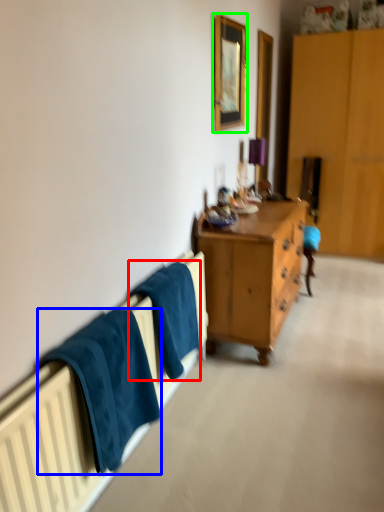
Question: Considering the real-world distances, which object is farthest from bath towel (highlighted by a red box)? towel/napkin (highlighted by a blue box) or picture frame (highlighted by a green box)?

Choices:
 (A) towel/napkin
 (B) picture frame

Answer: (B)